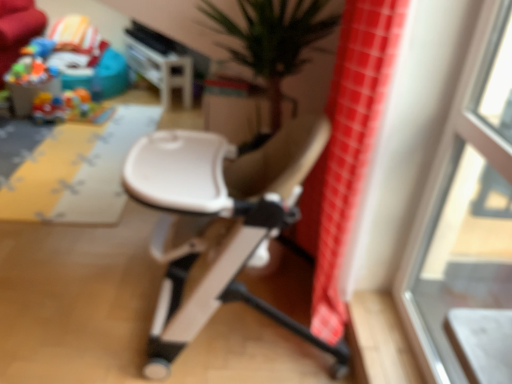
Measure the distance between transparent glass window at upper right and camera.

They are 1.10 meters apart.

Where is `white plastic chair at center`? Image resolution: width=512 pixels, height=384 pixels. white plastic chair at center is located at coordinates (220, 221).

Describe the element at coordinates (78, 171) in the screenshot. The width and height of the screenshot is (512, 384). I see `yellow fabric play mat at left` at that location.

The image size is (512, 384). Identify the location of yellow fabric play mat at left. (78, 171).

The height and width of the screenshot is (384, 512). Find the location of `transparent glass window at upper right`. transparent glass window at upper right is located at coordinates (466, 217).

Considering the relative sizes of white plastic table at upper center and red checkered fabric at right in the image provided, is white plastic table at upper center wider than red checkered fabric at right?

Yes.

Does point (181, 85) come closer to viewer compared to point (323, 315)?

No, it is behind (323, 315).

From the picture: Could you tell me if white plastic table at upper center is turned towards red checkered fabric at right?

No, white plastic table at upper center is not oriented towards red checkered fabric at right.

Does white plastic table at upper center appear on the right side of red checkered fabric at right?

No.

Is yellow fabric play mat at left in front of or behind white plastic table at upper center in the image?

In the image, yellow fabric play mat at left appears in front of white plastic table at upper center.

Considering the points (145, 133) and (186, 100), which point is in front, point (145, 133) or point (186, 100)?

The point (145, 133) is in front.

From the image's perspective, is yellow fabric play mat at left on top of white plastic table at upper center?

Incorrect, from the image's perspective, yellow fabric play mat at left is lower than white plastic table at upper center.

Which of these two, yellow fabric play mat at left or white plastic table at upper center, stands shorter?

yellow fabric play mat at left.

From a real-world perspective, is white plastic chair at center positioned under white plastic table at upper center based on gravity?

No, from a real-world perspective, white plastic chair at center is not beneath white plastic table at upper center.

Looking at their sizes, would you say white plastic chair at center is wider or thinner than white plastic table at upper center?

white plastic chair at center is wider than white plastic table at upper center.

Can you confirm if white plastic chair at center is shorter than white plastic table at upper center?

Incorrect, the height of white plastic chair at center does not fall short of that of white plastic table at upper center.

Measure the distance from white plastic chair at center to white plastic table at upper center.

white plastic chair at center and white plastic table at upper center are 2.39 meters apart.

Is transparent glass window at upper right wider than plastic colorful toys at upper left?

No.

Is transparent glass window at upper right beside plastic colorful toys at upper left?

No.

Can plastic colorful toys at upper left be found inside transparent glass window at upper right?

No, plastic colorful toys at upper left is not a part of transparent glass window at upper right.

From a real-world perspective, is transparent glass window at upper right on top of plastic colorful toys at upper left?

Yes.

From a real-world perspective, is red checkered fabric at right beneath white plastic chair at center?

No, from a real-world perspective, red checkered fabric at right is not below white plastic chair at center.

Between point (371, 17) and point (236, 157), which one is positioned in front?

The point (371, 17) is more forward.

How different are the orientations of red checkered fabric at right and white plastic chair at center in degrees?

They differ by 1.04 degrees in their facing directions.

From the picture: Measure the distance between red checkered fabric at right and white plastic chair at center.

red checkered fabric at right is 13.53 inches away from white plastic chair at center.

Would you say transparent glass window at upper right contains red checkered fabric at right?

Definitely not — red checkered fabric at right is not inside transparent glass window at upper right.

In the scene shown: From a real-world perspective, which object stands above the other?

transparent glass window at upper right is physically above.

Is white plastic table at upper center next to plastic colorful toys at upper left?

white plastic table at upper center and plastic colorful toys at upper left are clearly separated.

Measure the distance between white plastic table at upper center and plastic colorful toys at upper left.

A distance of 22.12 inches exists between white plastic table at upper center and plastic colorful toys at upper left.

Between white plastic table at upper center and plastic colorful toys at upper left, which one has larger width?

plastic colorful toys at upper left.

Is white plastic table at upper center looking in the opposite direction of plastic colorful toys at upper left?

No, white plastic table at upper center is not facing away from plastic colorful toys at upper left.

There is a white plastic table at upper center. Identify the location of shower curtain above it (from a real-world perspective). The image size is (512, 384). (351, 142).

Image resolution: width=512 pixels, height=384 pixels. I want to click on table on the right of yellow fabric play mat at left, so click(162, 70).

Looking at the image, which one is located further to transparent glass window at upper right, white plastic table at upper center or white plastic chair at center?

The object further to transparent glass window at upper right is white plastic table at upper center.

Based on their spatial positions, is yellow fabric play mat at left or white plastic table at upper center closer to transparent glass window at upper right?

yellow fabric play mat at left.

Looking at this image, which object lies nearer to the anchor point white plastic chair at center, transparent glass window at upper right or plastic colorful toys at upper left?

transparent glass window at upper right.

Which object lies nearer to the anchor point white plastic chair at center, plastic colorful toys at upper left or transparent glass window at upper right?

Based on the image, transparent glass window at upper right appears to be nearer to white plastic chair at center.

Consider the image. From the image, which object appears to be farther from transparent glass window at upper right, white plastic chair at center or plastic colorful toys at upper left?

Based on the image, plastic colorful toys at upper left appears to be further to transparent glass window at upper right.

Estimate the real-world distances between objects in this image. Which object is further from plastic colorful toys at upper left, white plastic chair at center or yellow fabric play mat at left?

Among the two, white plastic chair at center is located further to plastic colorful toys at upper left.

Looking at the image, which one is located further to plastic colorful toys at upper left, white plastic chair at center or red checkered fabric at right?

The object further to plastic colorful toys at upper left is red checkered fabric at right.

When comparing their distances from white plastic table at upper center, does white plastic chair at center or plastic colorful toys at upper left seem closer?

plastic colorful toys at upper left lies closer to white plastic table at upper center than the other object.

Locate an element on the screen. The height and width of the screenshot is (384, 512). plain between red checkered fabric at right and plastic colorful toys at upper left in the front-back direction is located at coordinates (78, 171).

Locate an element on the screen. This screenshot has height=384, width=512. shower curtain between white plastic chair at center and transparent glass window at upper right from left to right is located at coordinates pos(351,142).

Locate an element on the screen. Image resolution: width=512 pixels, height=384 pixels. chair between red checkered fabric at right and white plastic table at upper center along the z-axis is located at coordinates (220, 221).

You are a GUI agent. You are given a task and a screenshot of the screen. Output one action in this format:
    pyautogui.click(x=<x>, y=<y>)
    Task: Click on the plain between transparent glass window at upper right and white plastic table at upper center in the front-back direction
    The width and height of the screenshot is (512, 384).
    Given the screenshot: What is the action you would take?
    pyautogui.click(x=78, y=171)